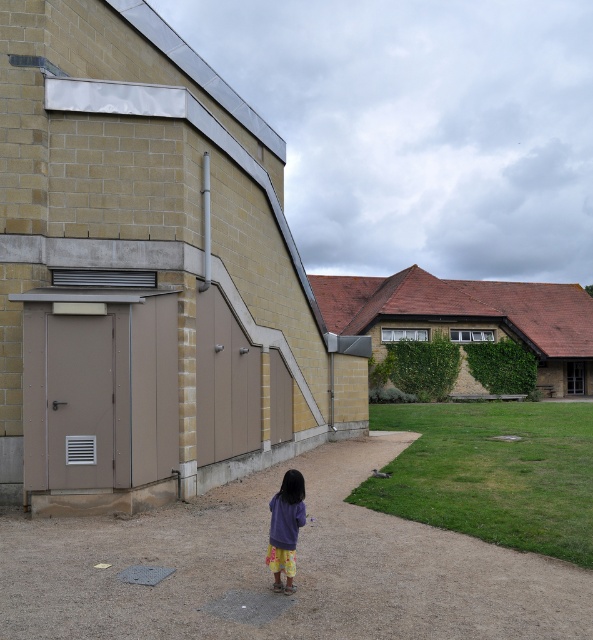
You are a gardener who wants to walk from the dirt path at lower center to the purple fabric at center. Which path should you take if you want to avoid stepping on the grass?

The dirt path at lower center is bigger than the purple fabric at center, so you should take the dirt path at lower center to avoid stepping on the grass.

You are standing at the grassy area where the child is located and want to walk to the dirt path at lower center. According to the coordinates provided, in which direction should you move relative to your current position?

The dirt path at lower center is located at coordinates point (296, 566). Since you are at the grassy area near the child, you should move towards the lower center direction to reach the dirt path at lower center.